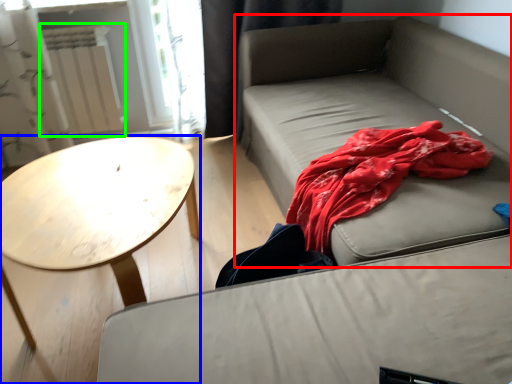
Question: Based on their relative distances, which object is nearer to studio couch (highlighted by a red box)? Choose from coffee table (highlighted by a blue box) and radiator (highlighted by a green box).

Choices:
 (A) coffee table
 (B) radiator

Answer: (A)